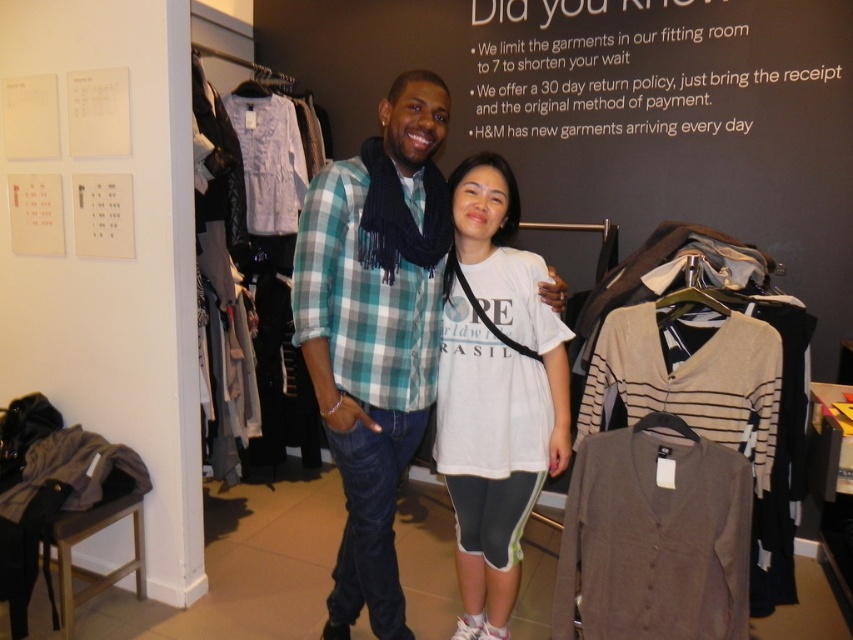
Question: Does matte blue plaid shirt at center appear on the right side of white cotton t-shirt at center?

Choices:
 (A) no
 (B) yes

Answer: (A)

Question: Considering the real-world distances, which object is closest to the white cotton t-shirt at center?

Choices:
 (A) dark gray knit cardigan at center
 (B) matte blue plaid shirt at center

Answer: (B)

Question: Can you confirm if matte blue plaid shirt at center is positioned above white cotton t-shirt at center?

Choices:
 (A) no
 (B) yes

Answer: (B)

Question: Estimate the real-world distances between objects in this image. Which object is farther from the matte blue plaid shirt at center?

Choices:
 (A) dark gray knit cardigan at center
 (B) white cotton t-shirt at center

Answer: (A)

Question: Does matte blue plaid shirt at center have a smaller size compared to dark gray knit cardigan at center?

Choices:
 (A) no
 (B) yes

Answer: (A)

Question: Which point is closer to the camera?

Choices:
 (A) dark gray knit cardigan at center
 (B) matte blue plaid shirt at center
 (C) white cotton t-shirt at center

Answer: (A)